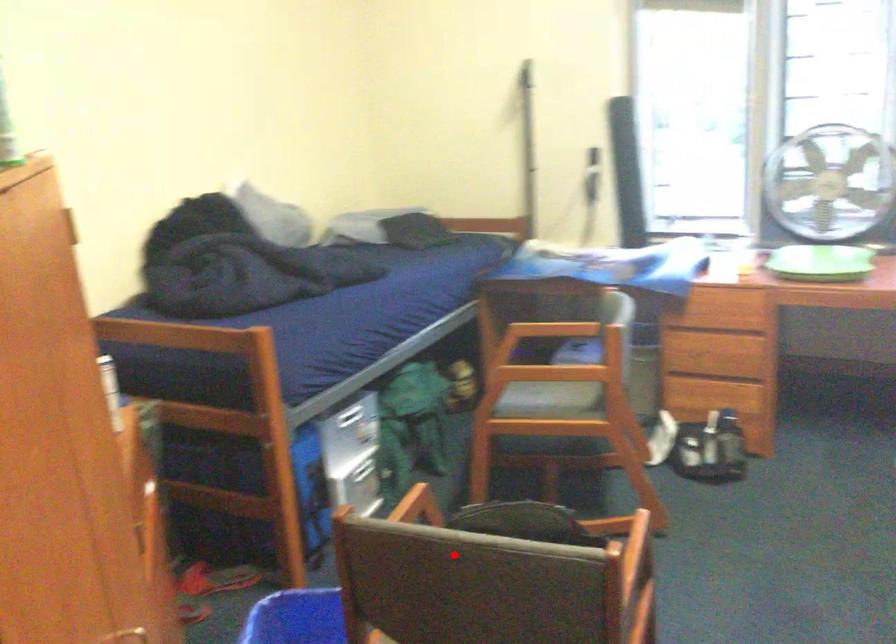
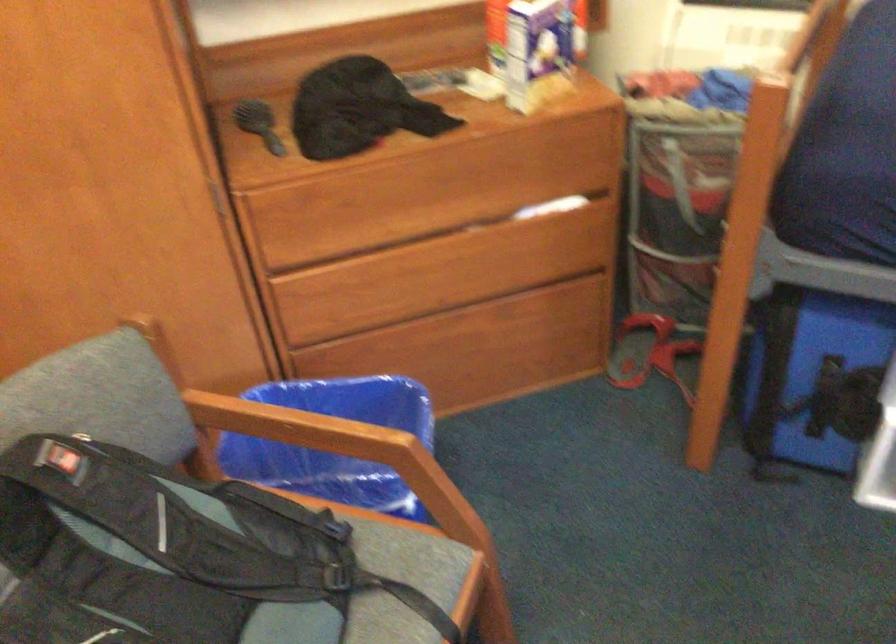
Question: A red point is marked in image1. In image2, is the corresponding 3D point closer to the camera or farther? Reply with the corresponding letter.

Choices:
 (A) The corresponding 3D point is closer.
 (B) The corresponding 3D point is farther.

Answer: (A)